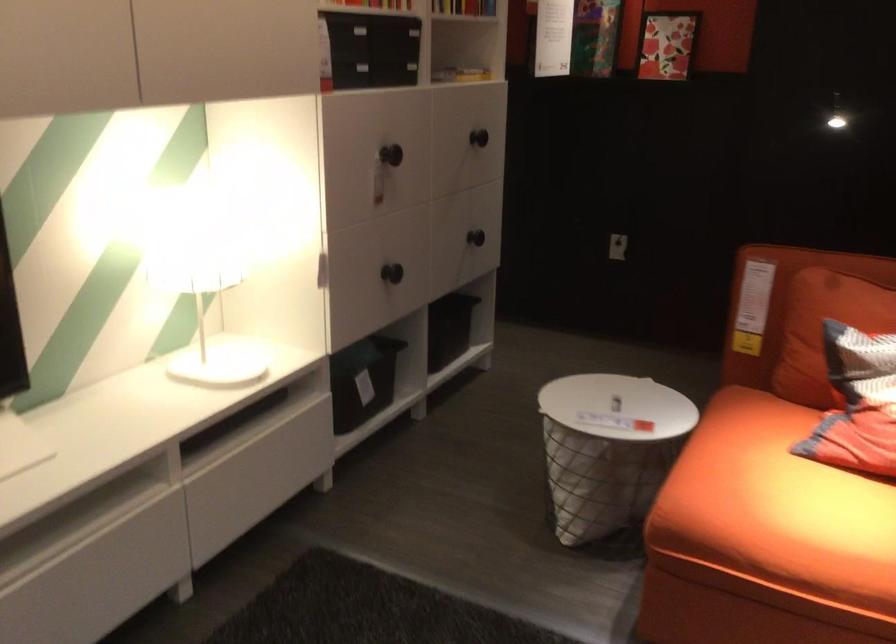
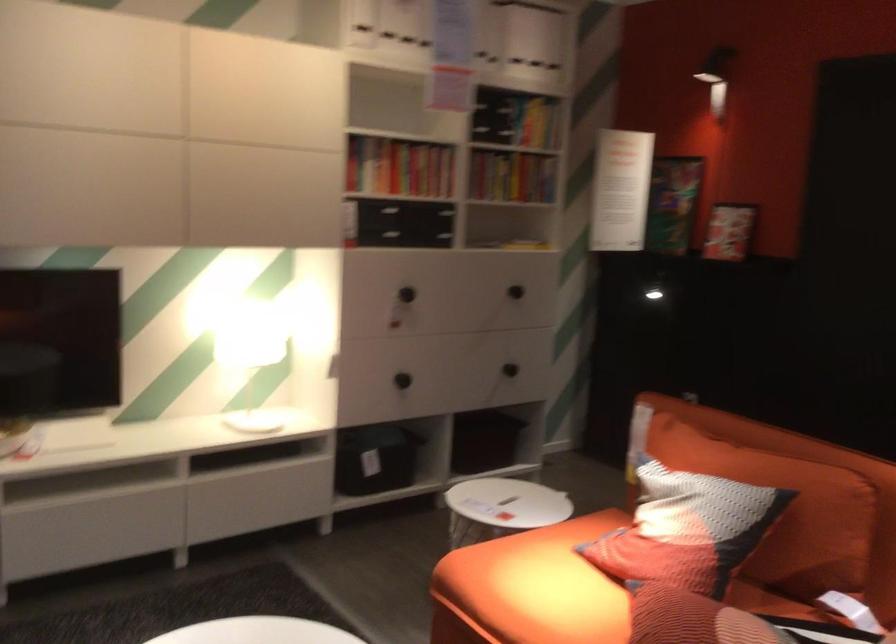
Find the pixel in the second image that matches point (487, 144) in the first image.

(514, 292)